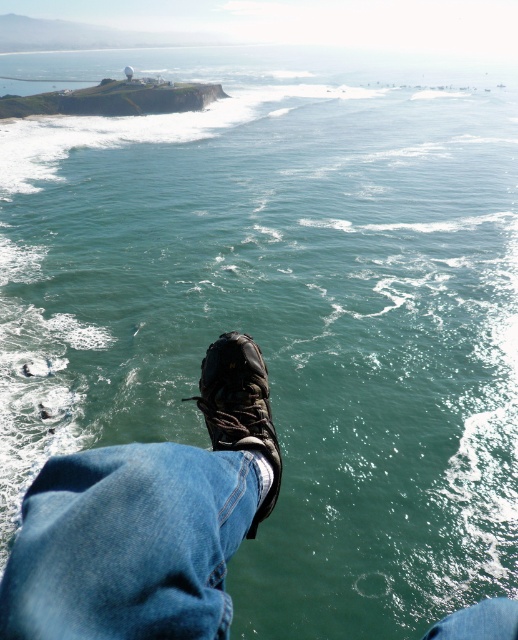
Is black leather boot at center positioned behind smooth concrete cliff at upper left?

No, black leather boot at center is closer to the viewer.

Is black leather boot at center taller than smooth concrete cliff at upper left?

Incorrect, black leather boot at center's height is not larger of smooth concrete cliff at upper left's.

Find the location of a particular element. black leather boot at center is located at coordinates (239, 406).

Is dark brown leather shoe at center smaller than black leather boot at center?

Actually, dark brown leather shoe at center might be larger than black leather boot at center.

Can you confirm if dark brown leather shoe at center is positioned to the right of black leather boot at center?

No, dark brown leather shoe at center is not to the right of black leather boot at center.

This screenshot has height=640, width=518. In order to click on dark brown leather shoe at center in this screenshot , I will do `click(149, 522)`.

Can you confirm if dark brown leather shoe at center is thinner than smooth concrete cliff at upper left?

Yes.

Is point (56, 580) closer to camera compared to point (135, 88)?

Yes, point (56, 580) is closer to viewer.

I want to click on dark brown leather shoe at center, so click(x=149, y=522).